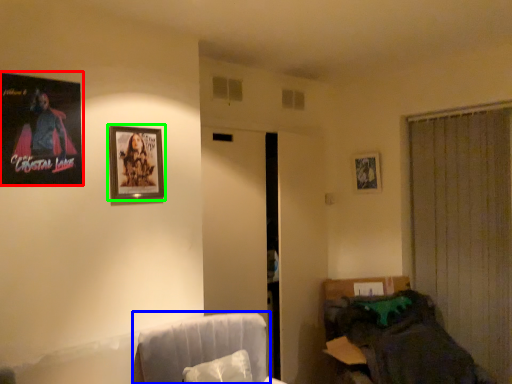
Question: Which object is positioned farthest from picture frame (highlighted by a red box)? Select from swivel chair (highlighted by a blue box) and picture frame (highlighted by a green box).

Choices:
 (A) swivel chair
 (B) picture frame

Answer: (A)